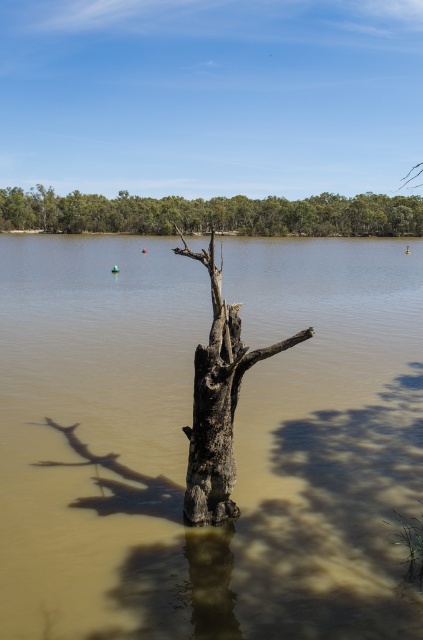
Is brown muddy water at center to the right of charcoal rough tree trunk at center from the viewer's perspective?

No, brown muddy water at center is not to the right of charcoal rough tree trunk at center.

Is brown muddy water at center shorter than charcoal rough tree trunk at center?

No.

Image resolution: width=423 pixels, height=640 pixels. I want to click on brown muddy water at center, so click(x=187, y=442).

In the scene shown: Which is more to the left, green leafy trees at upper center or charcoal rough tree trunk at center?

green leafy trees at upper center is more to the left.

Identify the location of green leafy trees at upper center. The height and width of the screenshot is (640, 423). (211, 212).

Does brown muddy water at center have a smaller size compared to green leafy trees at upper center?

Yes, brown muddy water at center is smaller than green leafy trees at upper center.

Between brown muddy water at center and green leafy trees at upper center, which one has more height?

With more height is green leafy trees at upper center.

Between point (162, 380) and point (239, 204), which one is positioned in front?

Positioned in front is point (162, 380).

You are a GUI agent. You are given a task and a screenshot of the screen. Output one action in this format:
    pyautogui.click(x=<x>, y=<y>)
    Task: Click on the brown muddy water at center
    This screenshot has width=423, height=640.
    Given the screenshot: What is the action you would take?
    pyautogui.click(x=187, y=442)